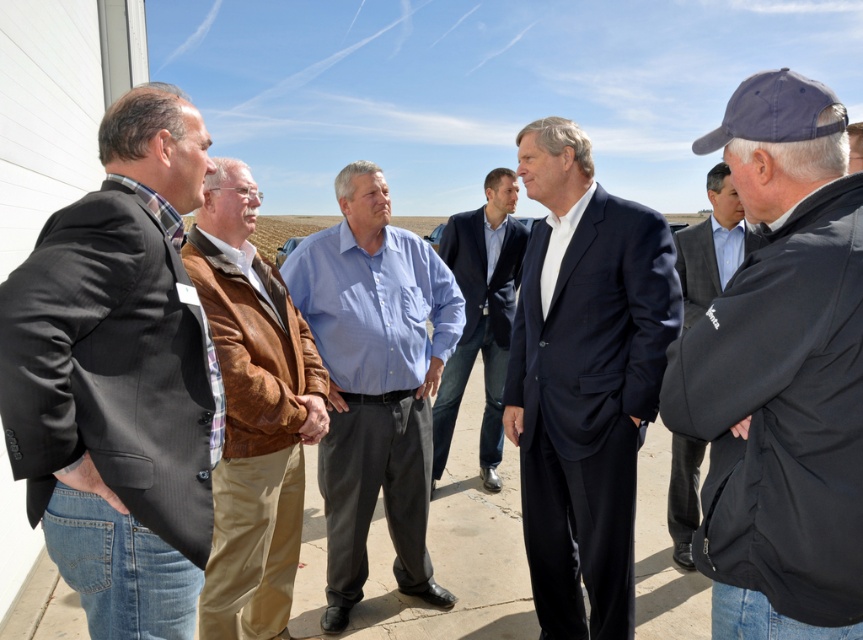
The height and width of the screenshot is (640, 863). What do you see at coordinates (375, 381) in the screenshot?
I see `blue cotton shirt at center` at bounding box center [375, 381].

Can you confirm if blue cotton shirt at center is shorter than brown suede jacket at center?

No, blue cotton shirt at center is not shorter than brown suede jacket at center.

Image resolution: width=863 pixels, height=640 pixels. I want to click on blue cotton shirt at center, so click(x=375, y=381).

Find the location of a particular element. The height and width of the screenshot is (640, 863). blue cotton shirt at center is located at coordinates (375, 381).

Is dark blue cap at center bigger than dark gray jacket at right?

Actually, dark blue cap at center might be smaller than dark gray jacket at right.

Can you confirm if dark blue cap at center is positioned above dark gray jacket at right?

Incorrect, dark blue cap at center is not positioned above dark gray jacket at right.

Who is more forward, (x=799, y=84) or (x=721, y=168)?

Point (x=799, y=84) is more forward.

This screenshot has width=863, height=640. Find the location of `dark blue cap at center`. dark blue cap at center is located at coordinates (780, 376).

Who is higher up, dark blue suit at center or brown suede jacket at center?

dark blue suit at center is above.

Can you confirm if dark blue suit at center is taller than brown suede jacket at center?

Correct, dark blue suit at center is much taller as brown suede jacket at center.

Is point (668, 268) positioned behind point (293, 332)?

No, it is in front of (293, 332).

Locate an element on the screen. dark blue suit at center is located at coordinates [x=584, y=380].